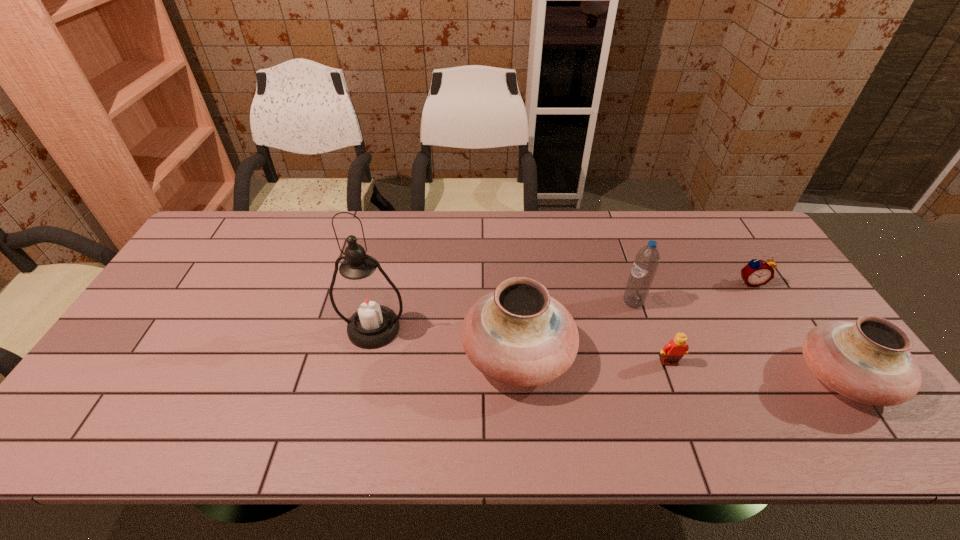
I want to click on the taller pottery, so click(518, 335).

What are the coordinates of `the left pottery` in the screenshot? It's located at (518, 335).

Find the location of a particular element. the fourth tallest object is located at coordinates (868, 361).

At what (x,y) coordinates should I click in order to perform the action: click on the shorter pottery. Please return your answer as a coordinate pair (x, y). The image size is (960, 540). Looking at the image, I should click on (868, 361).

Locate an element on the screen. This screenshot has height=540, width=960. alarm clock is located at coordinates (756, 273).

The width and height of the screenshot is (960, 540). What are the coordinates of `water bottle` in the screenshot? It's located at (647, 259).

Locate an element on the screen. This screenshot has height=540, width=960. the tallest object is located at coordinates (366, 300).

Locate an element on the screen. This screenshot has height=540, width=960. oil lamp is located at coordinates (366, 300).

Identify the location of Lego. This screenshot has height=540, width=960. (672, 352).

This screenshot has width=960, height=540. Find the location of `free spot located 0.320m on the right of the left pottery`. free spot located 0.320m on the right of the left pottery is located at coordinates (696, 355).